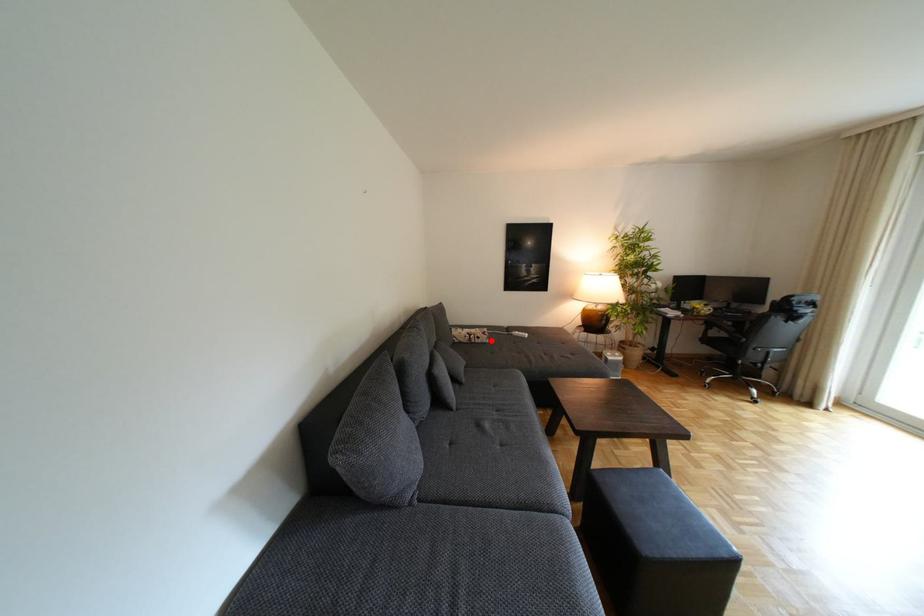
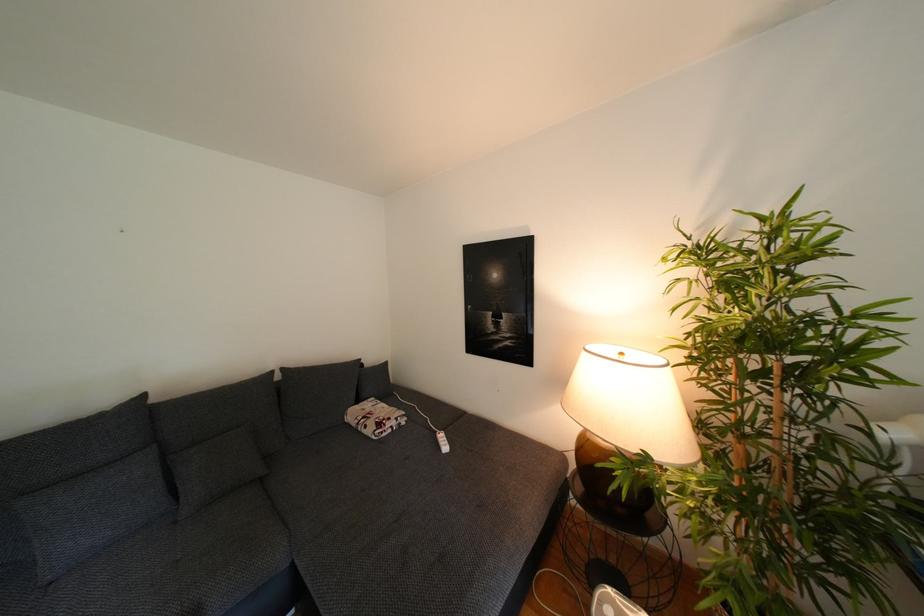
The point at the highlighted location is marked in the first image. Where is the corresponding point in the second image?

(378, 431)